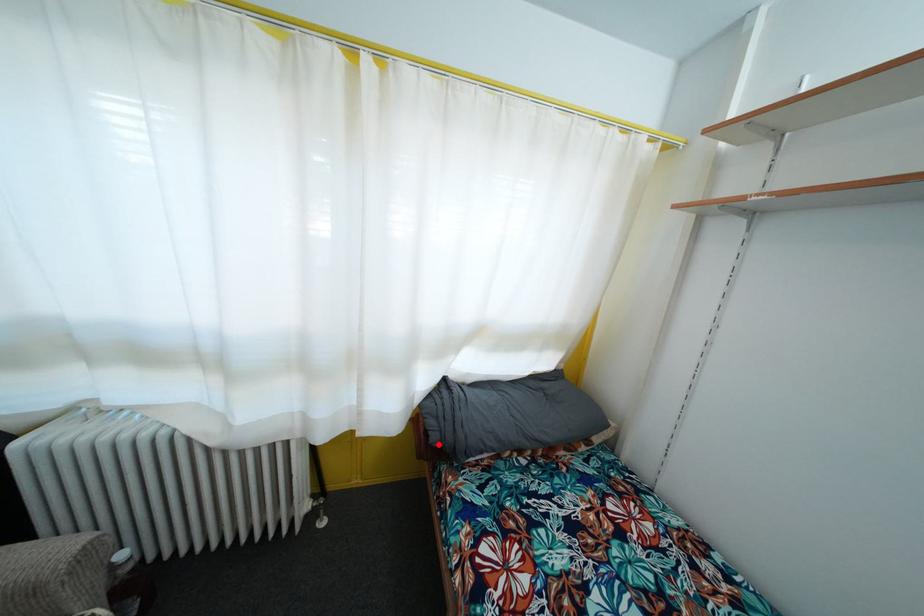
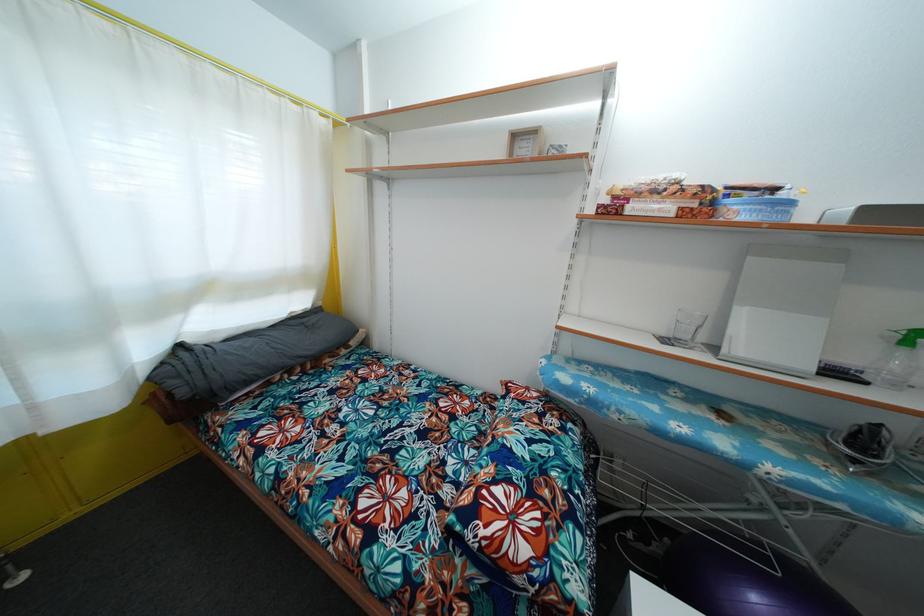
In the second image, find the point that corresponds to the highlighted location in the first image.

(187, 399)